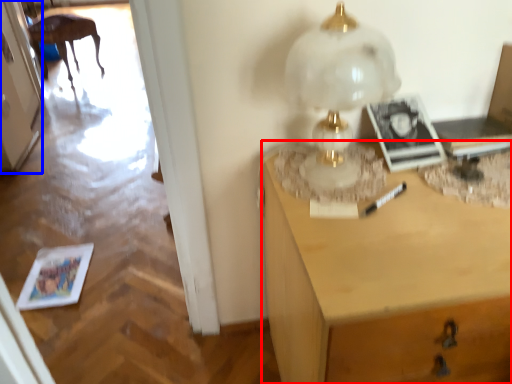
Question: Among these objects, which one is farthest to the camera, desk (highlighted by a red box) or door (highlighted by a blue box)?

Choices:
 (A) desk
 (B) door

Answer: (B)